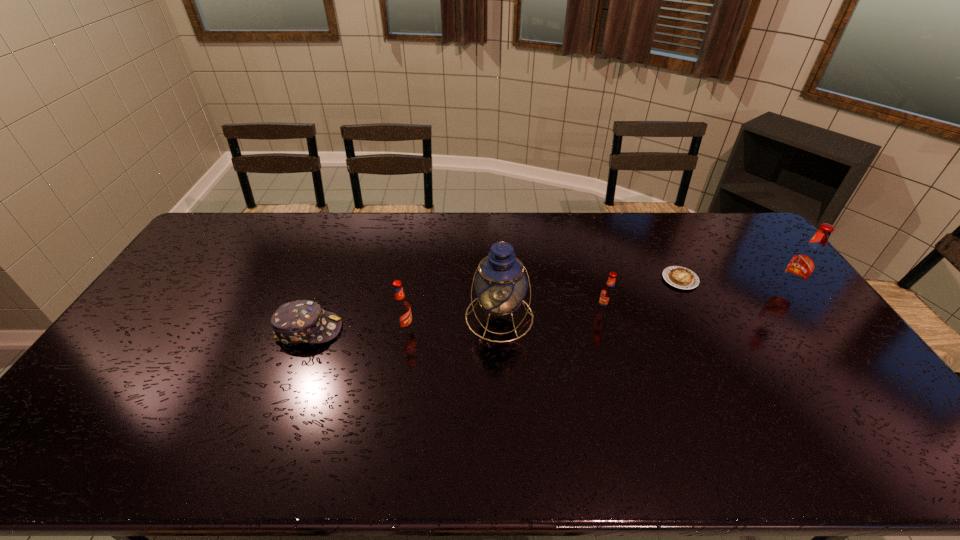
Considering the uniform spacing of root beers, where should an additional root beer be positioned on the left? Please locate a free spot. Please provide its 2D coordinates. Your answer should be formatted as a tuple, i.e. [(x, y)], where the tuple contains the x and y coordinates of a point satisfying the conditions above.

[(187, 350)]